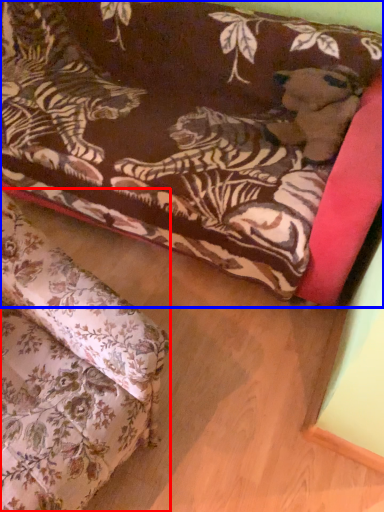
Question: Which object is further to the camera taking this photo, studio couch (highlighted by a red box) or studio couch (highlighted by a blue box)?

Choices:
 (A) studio couch
 (B) studio couch

Answer: (B)